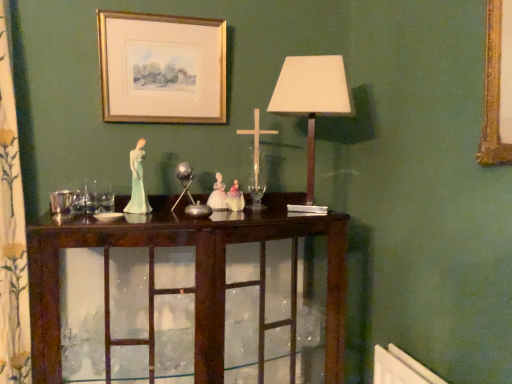
Question: Would you say porcelain figure at center is to the left or to the right of dark wood cabinet at center in the picture?

Choices:
 (A) left
 (B) right

Answer: (A)

Question: From the image's perspective, is porcelain figure at center positioned above or below dark wood cabinet at center?

Choices:
 (A) above
 (B) below

Answer: (A)

Question: Considering the real-world distances, which object is closest to the matte white lampshade at center?

Choices:
 (A) porcelain figure at center
 (B) floral-patterned fabric at left
 (C) dark wood cabinet at center
 (D) gold/glossy picture frame at upper center

Answer: (D)

Question: Considering the real-world distances, which object is closest to the gold/glossy picture frame at upper center?

Choices:
 (A) floral-patterned fabric at left
 (B) matte white lampshade at center
 (C) dark wood cabinet at center
 (D) porcelain figure at center

Answer: (D)